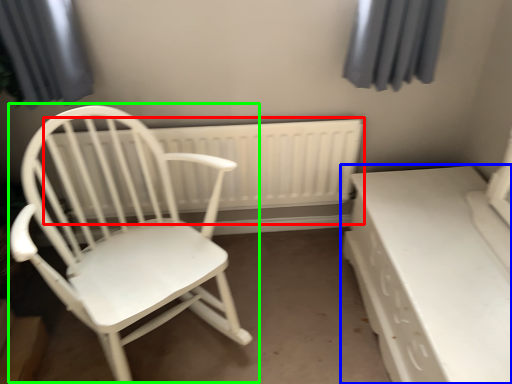
Question: Based on their relative distances, which object is nearer to radiator (highlighted by a red box)? Choose from table (highlighted by a blue box) and chair (highlighted by a green box).

Choices:
 (A) table
 (B) chair

Answer: (B)